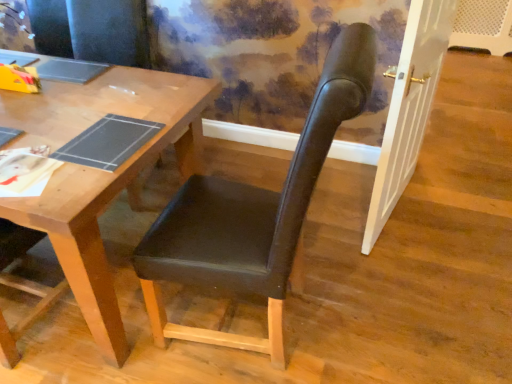
You are a GUI agent. You are given a task and a screenshot of the screen. Output one action in this format:
    pyautogui.click(x=<x>, y=<y>)
    Task: Click on the free point above wooden desk at center (from a real-world perspective)
    This screenshot has width=512, height=384.
    Given the screenshot: What is the action you would take?
    pyautogui.click(x=62, y=111)